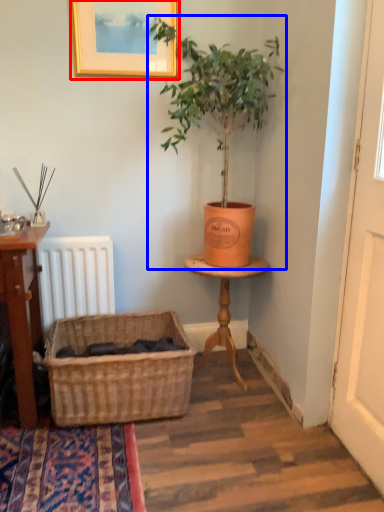
Question: Which of the following is the farthest to the observer, picture frame (highlighted by a red box) or houseplant (highlighted by a blue box)?

Choices:
 (A) picture frame
 (B) houseplant

Answer: (A)